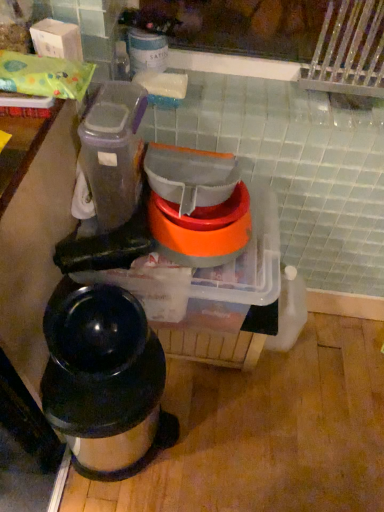
Question: In the image, is orange translucent bowls at center, which appears as the 2th appliance when ordered from the bottom, positioned in front of or behind translucent plastic container at upper left, which is the 3th appliance in bottom-to-top order?

Choices:
 (A) behind
 (B) front

Answer: (A)

Question: Is point (183, 253) positioned closer to the camera than point (87, 134)?

Choices:
 (A) closer
 (B) farther

Answer: (B)

Question: Considering the real-world distances, which object is closest to the shiny black thermos at lower left?

Choices:
 (A) translucent plastic container at upper left, acting as the 1th appliance starting from the top
 (B) orange translucent bowls at center, which is counted as the 2th appliance, starting from the top
 (C) translucent plastic containers at center, the 1th appliance positioned from the bottom

Answer: (C)

Question: Which object is positioned closest to the shiny black thermos at lower left?

Choices:
 (A) translucent plastic container at upper left, acting as the 1th appliance starting from the top
 (B) translucent plastic containers at center, the 1th appliance positioned from the bottom
 (C) orange translucent bowls at center, which appears as the 2th appliance when ordered from the bottom

Answer: (B)